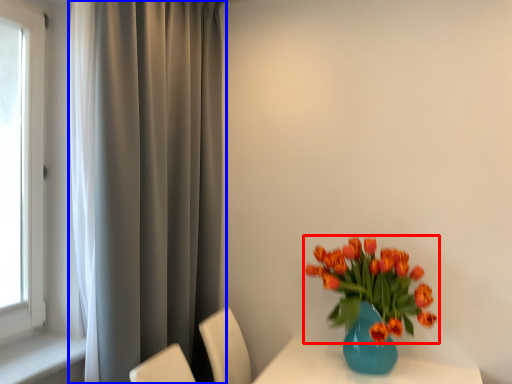
Question: Which object appears farthest to the camera in this image, flower (highlighted by a red box) or curtain (highlighted by a blue box)?

Choices:
 (A) flower
 (B) curtain

Answer: (A)